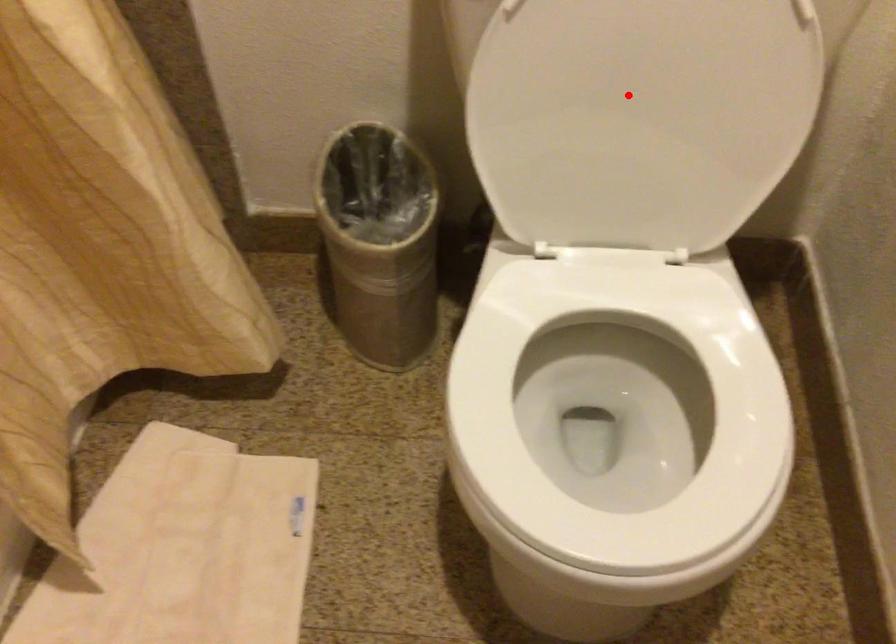
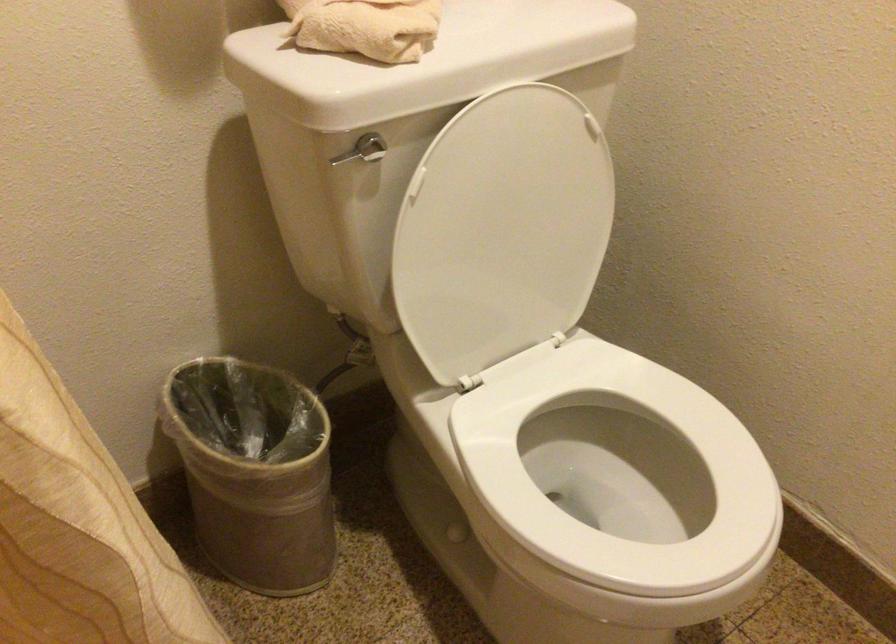
The point at the highlighted location is marked in the first image. Where is the corresponding point in the second image?

(502, 230)